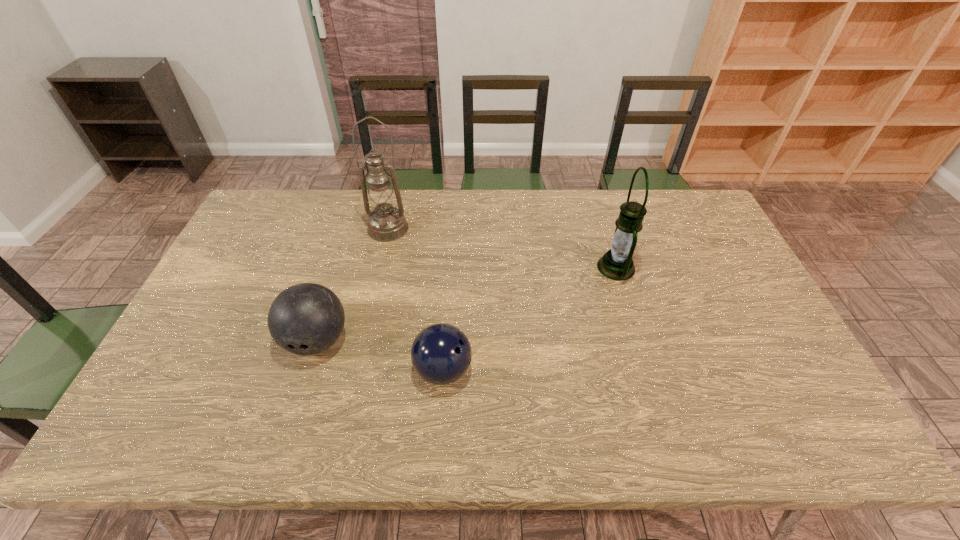
The height and width of the screenshot is (540, 960). I want to click on the farthest object, so click(386, 223).

At what (x,y) coordinates should I click in order to perform the action: click on lantern. Please return your answer as a coordinate pair (x, y). The height and width of the screenshot is (540, 960). Looking at the image, I should click on (617, 264).

This screenshot has width=960, height=540. Identify the location of the rightmost object. (617, 264).

Find the location of `the left bowling ball`. the left bowling ball is located at coordinates (305, 319).

In order to click on the second shortest object in this screenshot , I will do `click(305, 319)`.

Identify the location of the right bowling ball. The image size is (960, 540). (441, 353).

Identify the location of the shorter bowling ball. (441, 353).

Locate an element on the screen. The width and height of the screenshot is (960, 540). free space located 0.130m on the front of the farthest object is located at coordinates (378, 270).

Image resolution: width=960 pixels, height=540 pixels. Find the location of `vacant point located on the side where the third nearest object emits light`. vacant point located on the side where the third nearest object emits light is located at coordinates (555, 267).

Find the location of a particular element. free location located on the side where the third nearest object emits light is located at coordinates (542, 267).